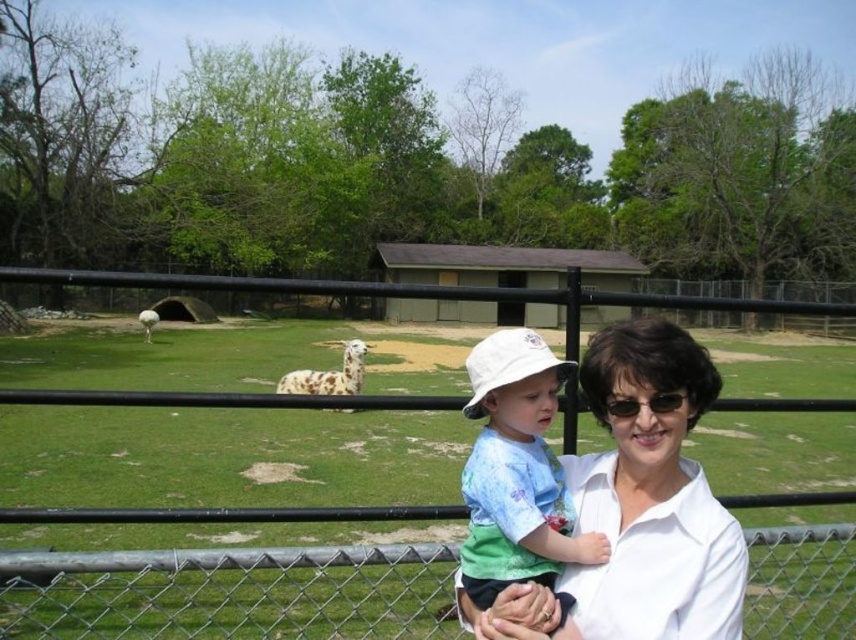
Question: Can you confirm if white matte shirt at center is thinner than black plastic sunglasses at center?

Choices:
 (A) no
 (B) yes

Answer: (A)

Question: Which of the following is the farthest from the observer?

Choices:
 (A) tap(670, 410)
 (B) tap(710, 369)
 (C) tap(490, 460)

Answer: (C)

Question: Does black plastic sunglasses at center have a lesser width compared to white woolen sheep at left?

Choices:
 (A) no
 (B) yes

Answer: (B)

Question: Estimate the real-world distances between objects in this image. Which object is closer to the white matte shirt at center?

Choices:
 (A) white woolen sheep at left
 (B) light blue cotton shirt at center

Answer: (B)

Question: Which object appears closest to the camera in this image?

Choices:
 (A) black plastic sunglasses at center
 (B) white woolen sheep at left
 (C) spotted wool alpaca at center
 (D) white matte shirt at center

Answer: (D)

Question: Does white matte shirt at center appear on the left side of light blue cotton shirt at center?

Choices:
 (A) yes
 (B) no

Answer: (B)